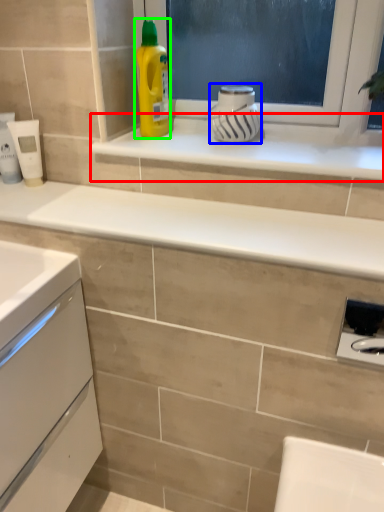
Question: Which is farther away from window sill (highlighted by a red box)? appliance (highlighted by a blue box) or cleaning product (highlighted by a green box)?

Choices:
 (A) appliance
 (B) cleaning product

Answer: (B)